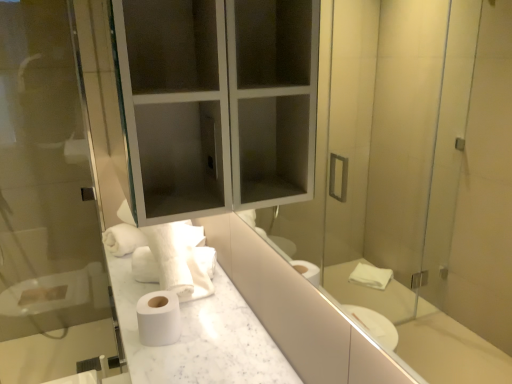
What do you see at coordinates (218, 103) in the screenshot? I see `matte glass medicine cabinet at upper center` at bounding box center [218, 103].

At what (x,y) coordinates should I click in order to perform the action: click on matte glass medicine cabinet at upper center. Please return your answer as a coordinate pair (x, y). Looking at the image, I should click on (218, 103).

Describe the element at coordinates (158, 318) in the screenshot. I see `white matte toilet paper at center` at that location.

The width and height of the screenshot is (512, 384). What do you see at coordinates (198, 336) in the screenshot? I see `white marble countertop at center` at bounding box center [198, 336].

This screenshot has height=384, width=512. Find the location of `white marble countertop at center`. white marble countertop at center is located at coordinates (198, 336).

Identify the location of matte glass medicine cabinet at upper center. The image size is (512, 384). (218, 103).

Which of these two, white matte toilet paper at center or transparent glass screen door at left, is thinner?

transparent glass screen door at left is thinner.

Considering the relative sizes of white matte toilet paper at center and transparent glass screen door at left in the image provided, is white matte toilet paper at center bigger than transparent glass screen door at left?

Incorrect, white matte toilet paper at center is not larger than transparent glass screen door at left.

Could you tell me if white matte toilet paper at center is facing transparent glass screen door at left?

No, white matte toilet paper at center is not facing towards transparent glass screen door at left.

From a real-world perspective, is white matte toilet paper at center above or below transparent glass screen door at left?

white matte toilet paper at center is situated lower than transparent glass screen door at left in the real world.

Which is more to the left, white matte toilet paper at center or white marble countertop at center?

From the viewer's perspective, white marble countertop at center appears more on the left side.

Choose the correct answer: Is white matte toilet paper at center inside white marble countertop at center or outside it?

white matte toilet paper at center is not enclosed by white marble countertop at center.

Consider the image. Measure the distance from white matte toilet paper at center to white marble countertop at center.

white matte toilet paper at center is 4.60 inches from white marble countertop at center.

Image resolution: width=512 pixels, height=384 pixels. In order to click on toilet paper above the white marble countertop at center (from a real-world perspective) in this screenshot , I will do `click(158, 318)`.

Can you confirm if matte glass medicine cabinet at upper center is positioned to the right of white matte toilet paper at center?

No.

In the scene shown: From a real-world perspective, is matte glass medicine cabinet at upper center positioned under white matte toilet paper at center based on gravity?

No, from a real-world perspective, matte glass medicine cabinet at upper center is not beneath white matte toilet paper at center.

Is the surface of matte glass medicine cabinet at upper center in direct contact with white matte toilet paper at center?

No, matte glass medicine cabinet at upper center is not in contact with white matte toilet paper at center.

Is point (196, 170) more distant than point (154, 363)?

Yes, it is.

Where is `medicine cabinet to the left of white marble countertop at center`? Image resolution: width=512 pixels, height=384 pixels. medicine cabinet to the left of white marble countertop at center is located at coordinates (218, 103).

Which is correct: matte glass medicine cabinet at upper center is inside white marble countertop at center, or outside of it?

matte glass medicine cabinet at upper center is not enclosed by white marble countertop at center.

Which object is closer to the camera taking this photo, transparent glass screen door at left or matte glass medicine cabinet at upper center?

matte glass medicine cabinet at upper center is more forward.

Is matte glass medicine cabinet at upper center at the back of transparent glass screen door at left?

No.

From a real-world perspective, is transparent glass screen door at left under matte glass medicine cabinet at upper center?

Yes, from a real-world perspective, transparent glass screen door at left is beneath matte glass medicine cabinet at upper center.

From the image's perspective, which is above, transparent glass screen door at left or matte glass medicine cabinet at upper center?

matte glass medicine cabinet at upper center appears higher in the image.

From the picture: From the image's perspective, between matte glass medicine cabinet at upper center and transparent glass screen door at left, who is located below?

transparent glass screen door at left, from the image's perspective.

Locate an element on the screen. medicine cabinet above the transparent glass screen door at left (from a real-world perspective) is located at coordinates (218, 103).

Considering the relative positions of matte glass medicine cabinet at upper center and transparent glass screen door at left in the image provided, is matte glass medicine cabinet at upper center to the left or to the right of transparent glass screen door at left?

matte glass medicine cabinet at upper center is to the right of transparent glass screen door at left.

Looking at this image, is matte glass medicine cabinet at upper center facing away from transparent glass screen door at left?

No, matte glass medicine cabinet at upper center is not facing the opposite direction of transparent glass screen door at left.

How different are the orientations of white matte toilet paper at center and matte glass medicine cabinet at upper center in degrees?

There is a 0.58-degree angle between the facing directions of white matte toilet paper at center and matte glass medicine cabinet at upper center.

Do you think white matte toilet paper at center is within matte glass medicine cabinet at upper center, or outside of it?

white matte toilet paper at center is not enclosed by matte glass medicine cabinet at upper center.

Is white matte toilet paper at center aimed at matte glass medicine cabinet at upper center?

No, white matte toilet paper at center is not oriented towards matte glass medicine cabinet at upper center.

Which object is positioned more to the right, white matte toilet paper at center or matte glass medicine cabinet at upper center?

white matte toilet paper at center.

Identify the location of toilet paper located on the right of transparent glass screen door at left. The height and width of the screenshot is (384, 512). (158, 318).

Find the location of a particular element. The height and width of the screenshot is (384, 512). toilet paper that is below the white marble countertop at center (from the image's perspective) is located at coordinates (158, 318).

Which object lies nearer to the anchor point white marble countertop at center, transparent glass screen door at left or white matte toilet paper at center?

white matte toilet paper at center.

Considering their positions, is white marble countertop at center positioned closer to transparent glass screen door at left than matte glass medicine cabinet at upper center?

The object closer to transparent glass screen door at left is matte glass medicine cabinet at upper center.

Based on their spatial positions, is transparent glass screen door at left or white marble countertop at center closer to white matte toilet paper at center?

white marble countertop at center lies closer to white matte toilet paper at center than the other object.

Estimate the real-world distances between objects in this image. Which object is closer to white matte toilet paper at center, transparent glass screen door at left or matte glass medicine cabinet at upper center?

matte glass medicine cabinet at upper center is closer to white matte toilet paper at center.

Estimate the real-world distances between objects in this image. Which object is further from white marble countertop at center, matte glass medicine cabinet at upper center or transparent glass screen door at left?

Based on the image, transparent glass screen door at left appears to be further to white marble countertop at center.

Considering their positions, is white matte toilet paper at center positioned further to matte glass medicine cabinet at upper center than transparent glass screen door at left?

transparent glass screen door at left is positioned further to the anchor matte glass medicine cabinet at upper center.

When comparing their distances from white matte toilet paper at center, does matte glass medicine cabinet at upper center or white marble countertop at center seem closer?

white marble countertop at center is positioned closer to the anchor white matte toilet paper at center.

Considering their positions, is white marble countertop at center positioned further to white matte toilet paper at center than transparent glass screen door at left?

Among the two, transparent glass screen door at left is located further to white matte toilet paper at center.

At what (x,y) coordinates should I click in order to perform the action: click on medicine cabinet situated between transparent glass screen door at left and white matte toilet paper at center from left to right. Please return your answer as a coordinate pair (x, y). This screenshot has height=384, width=512. Looking at the image, I should click on (218, 103).

The height and width of the screenshot is (384, 512). What are the coordinates of `counter top located between transparent glass screen door at left and white matte toilet paper at center in the left-right direction` in the screenshot? It's located at [198, 336].

You are a GUI agent. You are given a task and a screenshot of the screen. Output one action in this format:
    pyautogui.click(x=<x>, y=<y>)
    Task: Click on the counter top between matte glass medicine cabinet at upper center and white matte toilet paper at center from top to bottom
    
    Given the screenshot: What is the action you would take?
    pyautogui.click(x=198, y=336)

Identify the location of medicine cabinet between transparent glass screen door at left and white marble countertop at center from left to right. Image resolution: width=512 pixels, height=384 pixels. (218, 103).